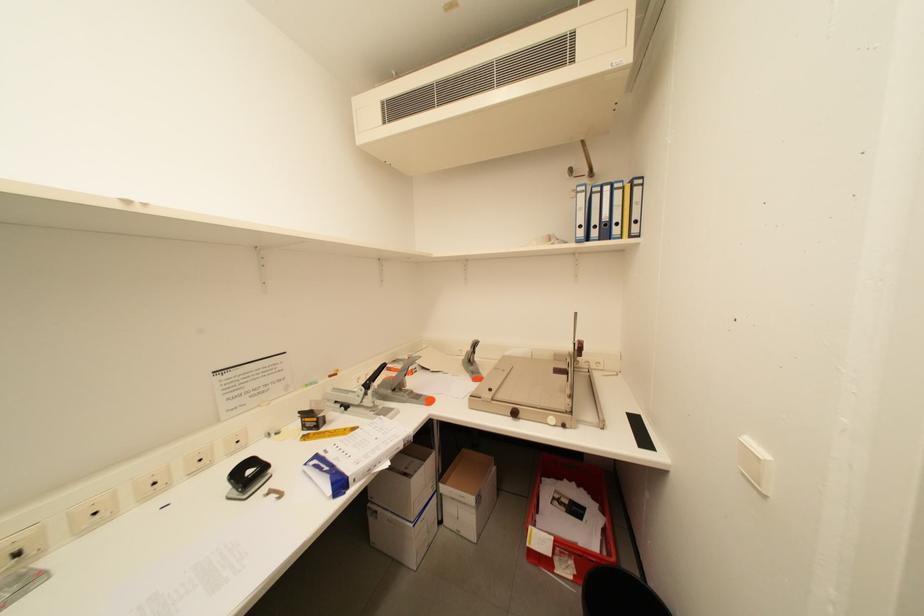
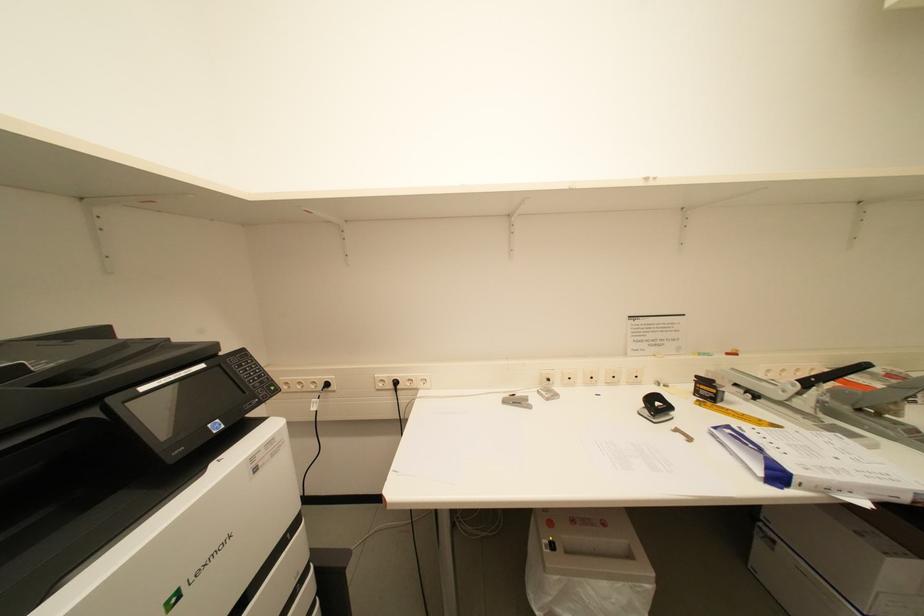
Question: The camera is either moving clockwise (left) or counter-clockwise (right) around the object. The first image is from the beginning of the video and the second image is from the end. Is the camera moving left or right when shooting the video?

Choices:
 (A) Left
 (B) Right

Answer: (B)